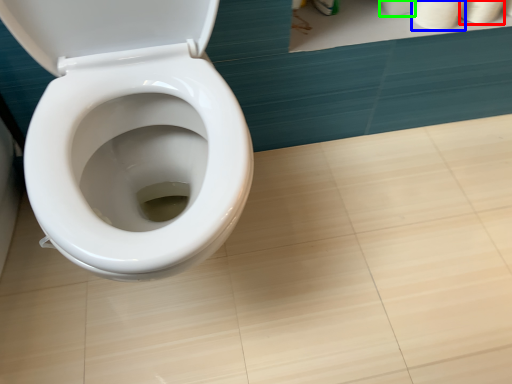
Question: Which object is the farthest from toilet paper (highlighted by a red box)? Choose among these: toilet paper (highlighted by a blue box) or toilet paper (highlighted by a green box).

Choices:
 (A) toilet paper
 (B) toilet paper

Answer: (B)